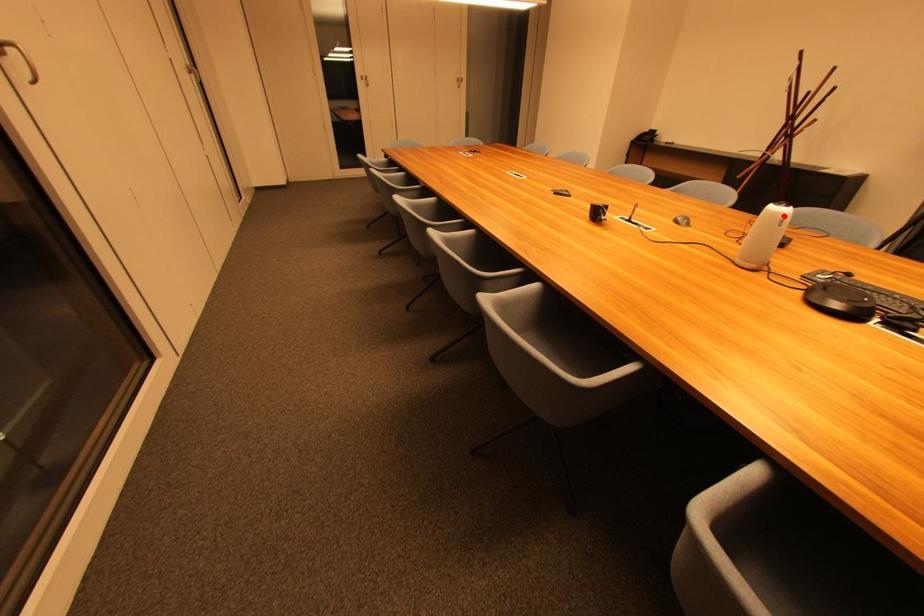
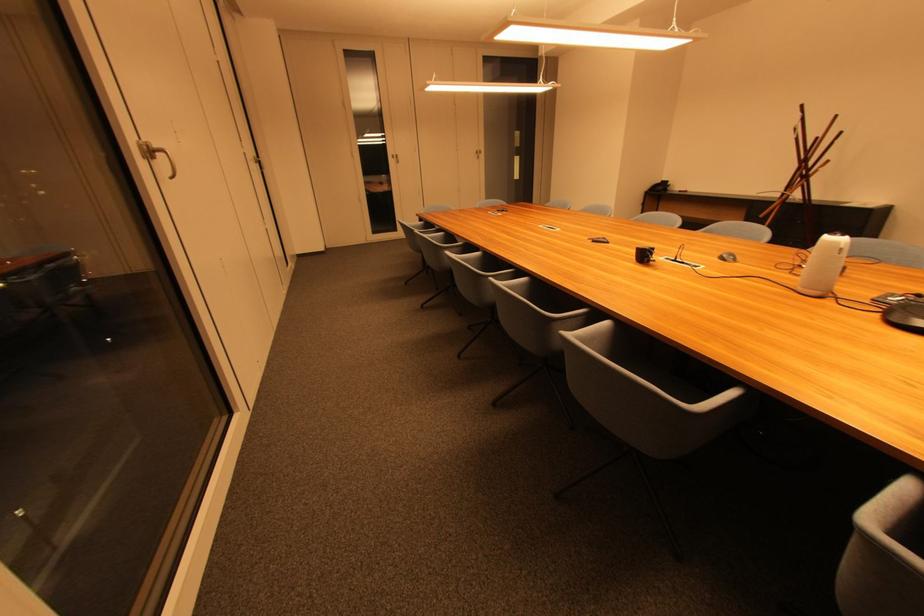
Find the pixel in the second image that matches the highlighted location in the first image.

(841, 245)